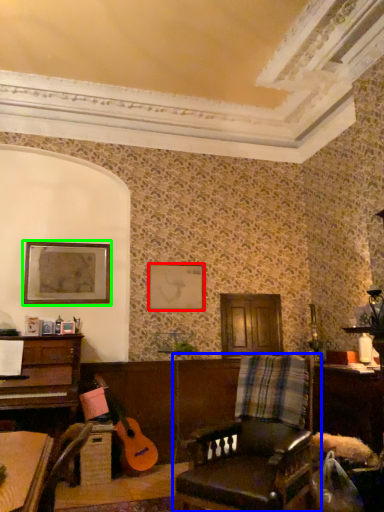
Question: Which is farther away from picture frame (highlighted by a red box)? chair (highlighted by a blue box) or picture frame (highlighted by a green box)?

Choices:
 (A) chair
 (B) picture frame

Answer: (A)